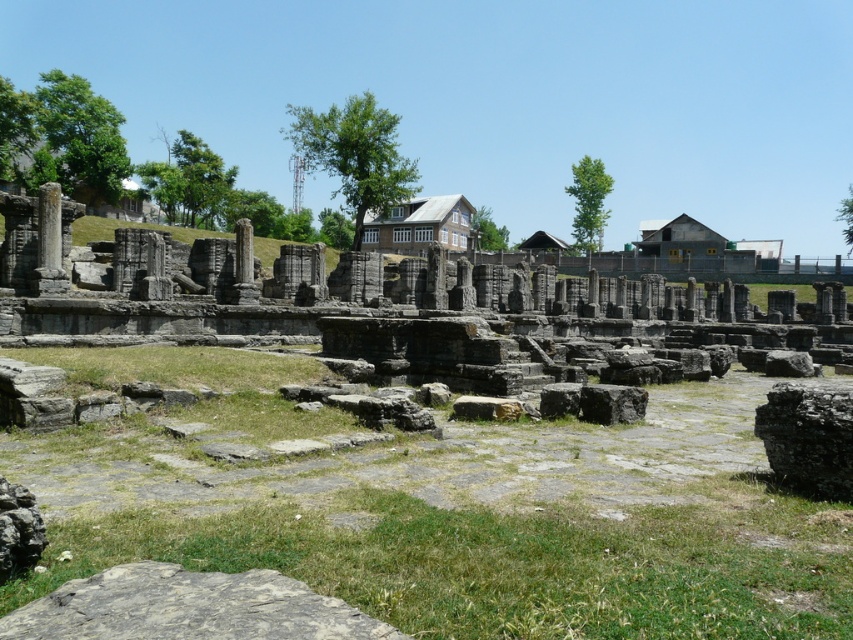
You are standing at the ancient ruin site and want to take a photo that includes both the point at coordinates point (164, 605) and the point at coordinates point (32, 512). Since you want the ruins to look as layered as possible, which point should you focus on first to ensure both are in the frame?

You should focus on point (164, 605) first because it is in front of point (32, 512), allowing both points to be layered in the photo.

You are an archaeologist examining the ancient ruin site. You notice two objects of interest in the foreground. The gray rough stone at lower right and the rusty metallic rock at lower left. Which object is taller?

The gray rough stone at lower right is taller than the rusty metallic rock at lower left.

You are an archaeologist standing at the edge of the ancient ruin site. You see the gray rough stone at lower left and the rusty metallic rock at lower left. If you want to place a measuring tape between them to document their distance, will the 5 meter measuring tape be sufficient?

The gray rough stone at lower left and rusty metallic rock at lower left are 5.81 meters apart. Since the measuring tape is only 5 meters long, it will not be sufficient to measure the full distance between them.